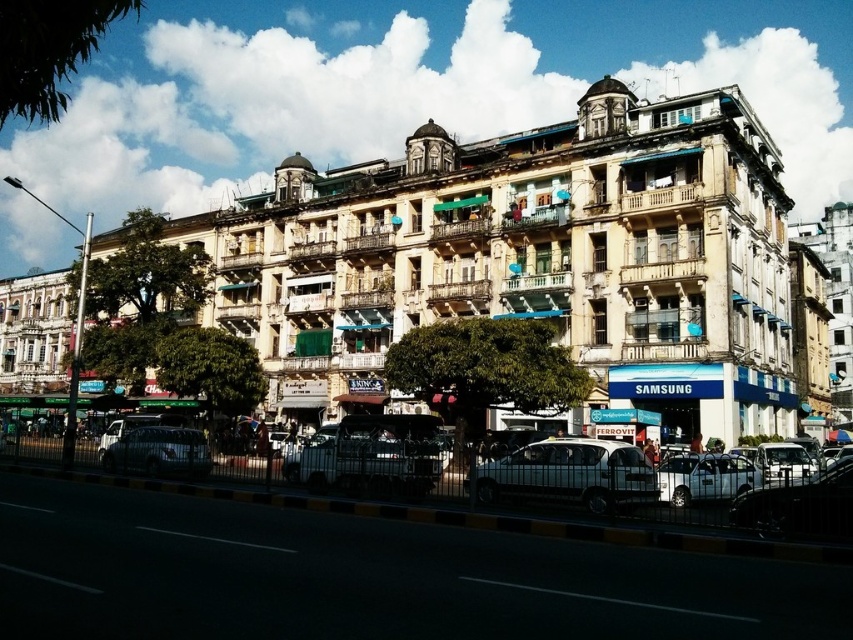
Question: Is metallic silver van at center positioned before silver metallic sedan at center?

Choices:
 (A) no
 (B) yes

Answer: (A)

Question: Is the position of beige stone building at center more distant than that of silver metallic sedan at center?

Choices:
 (A) yes
 (B) no

Answer: (A)

Question: Is beige stone building at center thinner than silver metallic sedan at center?

Choices:
 (A) no
 (B) yes

Answer: (A)

Question: Which object is closer to the camera taking this photo?

Choices:
 (A) metallic silver car at center
 (B) beige stone building at center
 (C) white matte van at center

Answer: (C)

Question: Which object is closer to the camera taking this photo?

Choices:
 (A) metallic silver car at center
 (B) white matte van at center
 (C) silver metallic sedan at center
 (D) beige stone building at center

Answer: (B)

Question: Among these points, which one is nearest to the camera?

Choices:
 (A) (393, 467)
 (B) (566, 280)

Answer: (A)